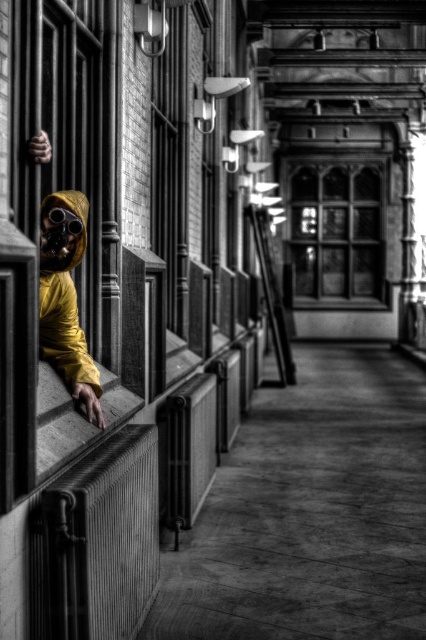
From the picture: You are an interior designer planning to install a new decorative item in the corridor. You have two options to choose from. The first is a large ornamental mirror that requires a space wider than the shiny black goggles at left. The second is a small wall sculpture that can fit in the space of the stained glass window at center. Which option would you recommend based on the available space?

The stained glass window at center might be wider than shiny black goggles at left, so the large ornamental mirror requiring space wider than the shiny black goggles at left can be placed there. However, the small wall sculpture that fits the stained glass window at center might also be suitable. Please verify the exact dimensions for accuracy.

You are an interior designer assessing the corridor. You need to determine if the shiny black goggles at left can be placed on a shelf that is exactly the height of the stained glass window at center. Can they fit vertically?

The stained glass window at center is taller than shiny black goggles at left, so the shiny black goggles at left can be placed on the shelf since their height is shorter than the shelf height.